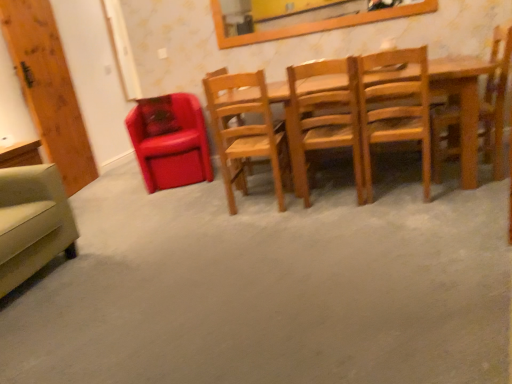
Identify the location of free space in front of wooden chair at center, the fifth chair viewed from the left. (426, 208).